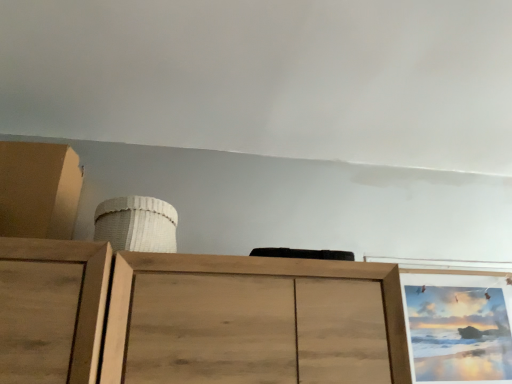
Question: Visually, is matte brown cabinet at upper left positioned to the left or to the right of wooden picture frame at upper right?

Choices:
 (A) right
 (B) left

Answer: (B)

Question: Relative to wooden picture frame at upper right, is matte brown cabinet at upper left in front or behind?

Choices:
 (A) front
 (B) behind

Answer: (A)

Question: Estimate the real-world distances between objects in this image. Which object is farther from the wooden picture frame at upper right?

Choices:
 (A) white woven basket at upper center
 (B) matte brown cabinet at upper left

Answer: (B)

Question: Which object is the farthest from the wooden picture frame at upper right?

Choices:
 (A) matte brown cabinet at upper left
 (B) white woven basket at upper center

Answer: (A)